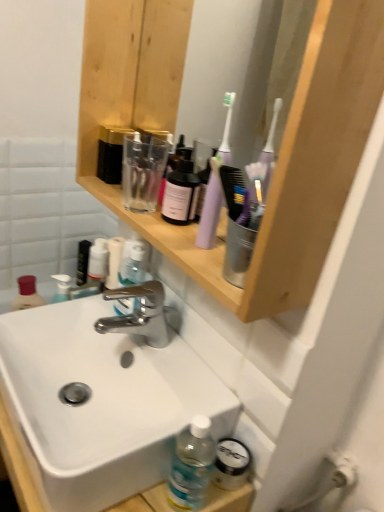
Question: Considering the relative sizes of polished chrome faucet at center and purple plastic toothbrush at upper center in the image provided, is polished chrome faucet at center smaller than purple plastic toothbrush at upper center?

Choices:
 (A) no
 (B) yes

Answer: (A)

Question: Is polished chrome faucet at center bigger than purple plastic toothbrush at upper center?

Choices:
 (A) no
 (B) yes

Answer: (B)

Question: Does polished chrome faucet at center appear on the left side of purple plastic toothbrush at upper center?

Choices:
 (A) yes
 (B) no

Answer: (A)

Question: From the image's perspective, is polished chrome faucet at center on purple plastic toothbrush at upper center?

Choices:
 (A) no
 (B) yes

Answer: (A)

Question: Is polished chrome faucet at center not near purple plastic toothbrush at upper center?

Choices:
 (A) no
 (B) yes

Answer: (A)

Question: Is clear plastic bottle at center wider or thinner than black matte tube at upper left?

Choices:
 (A) wide
 (B) thin

Answer: (A)

Question: Is clear plastic bottle at center situated inside black matte tube at upper left or outside?

Choices:
 (A) outside
 (B) inside

Answer: (A)

Question: Considering the relative positions of clear plastic bottle at center and black matte tube at upper left in the image provided, is clear plastic bottle at center to the left or to the right of black matte tube at upper left?

Choices:
 (A) left
 (B) right

Answer: (B)

Question: From the image's perspective, is clear plastic bottle at center located above or below black matte tube at upper left?

Choices:
 (A) above
 (B) below

Answer: (B)

Question: Considering the positions of point (117, 289) and point (89, 243), is point (117, 289) closer or farther from the camera than point (89, 243)?

Choices:
 (A) closer
 (B) farther

Answer: (A)

Question: From a real-world perspective, is polished chrome faucet at center above or below black matte tube at upper left?

Choices:
 (A) above
 (B) below

Answer: (A)

Question: In terms of width, does polished chrome faucet at center look wider or thinner when compared to black matte tube at upper left?

Choices:
 (A) thin
 (B) wide

Answer: (B)

Question: Is polished chrome faucet at center bigger or smaller than black matte tube at upper left?

Choices:
 (A) small
 (B) big

Answer: (A)

Question: Is point (81, 268) positioned closer to the camera than point (331, 234)?

Choices:
 (A) closer
 (B) farther

Answer: (B)

Question: From the image's perspective, is black matte tube at upper left positioned above or below wooden shelf at upper center?

Choices:
 (A) below
 (B) above

Answer: (A)